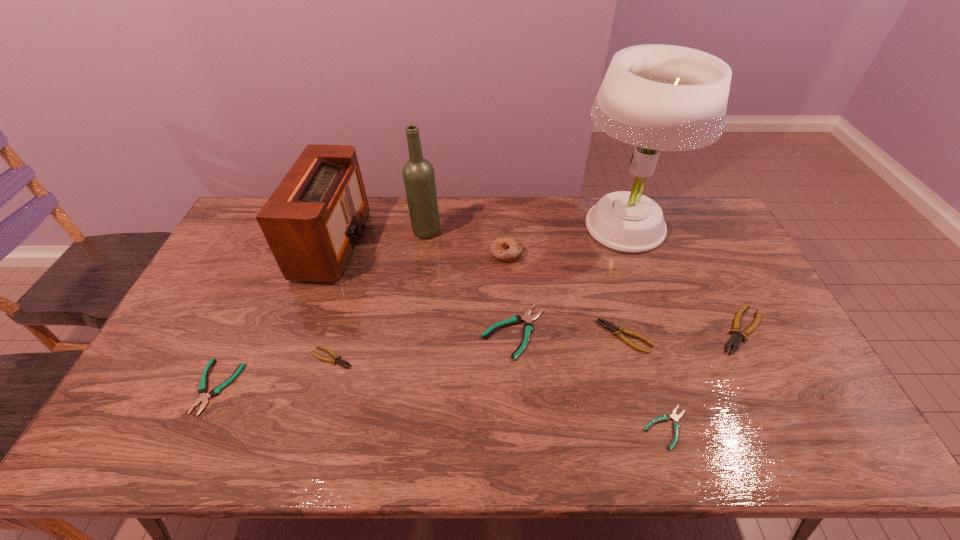
At what (x,y) coordinates should I click in order to perform the action: click on yellow pliers that is the third closest one to the green wine bottle. Please return your answer as a coordinate pair (x, y). This screenshot has width=960, height=540. Looking at the image, I should click on (735, 339).

Locate which yellow pliers is the closest to the leftmost yellow pliers. Please provide its 2D coordinates. Your answer should be formatted as a tuple, i.e. [(x, y)], where the tuple contains the x and y coordinates of a point satisfying the conditions above.

[(605, 324)]

Identify which teal pliers is the third nearest to the radio receiver. Please provide its 2D coordinates. Your answer should be formatted as a tuple, i.e. [(x, y)], where the tuple contains the x and y coordinates of a point satisfying the conditions above.

[(676, 425)]

Locate which teal pliers ranks second in proximity to the rightmost teal pliers. Please provide its 2D coordinates. Your answer should be formatted as a tuple, i.e. [(x, y)], where the tuple contains the x and y coordinates of a point satisfying the conditions above.

[(202, 389)]

Identify the location of blank area in the image that satisfies the following two spatial constraints: 1. on the front side of the seventh shortest object; 2. on the right side of the rightmost teal pliers. (516, 428).

Where is `free space that satisfies the following two spatial constraints: 1. on the front side of the shortest object; 2. on the left side of the second teal pliers from right to left`? Image resolution: width=960 pixels, height=540 pixels. free space that satisfies the following two spatial constraints: 1. on the front side of the shortest object; 2. on the left side of the second teal pliers from right to left is located at coordinates (519, 428).

At what (x,y) coordinates should I click in order to perform the action: click on free space that satisfies the following two spatial constraints: 1. on the front side of the second teal pliers from right to left; 2. on the right side of the wine bottle. Please return your answer as a coordinate pair (x, y). This screenshot has width=960, height=540. Looking at the image, I should click on (413, 332).